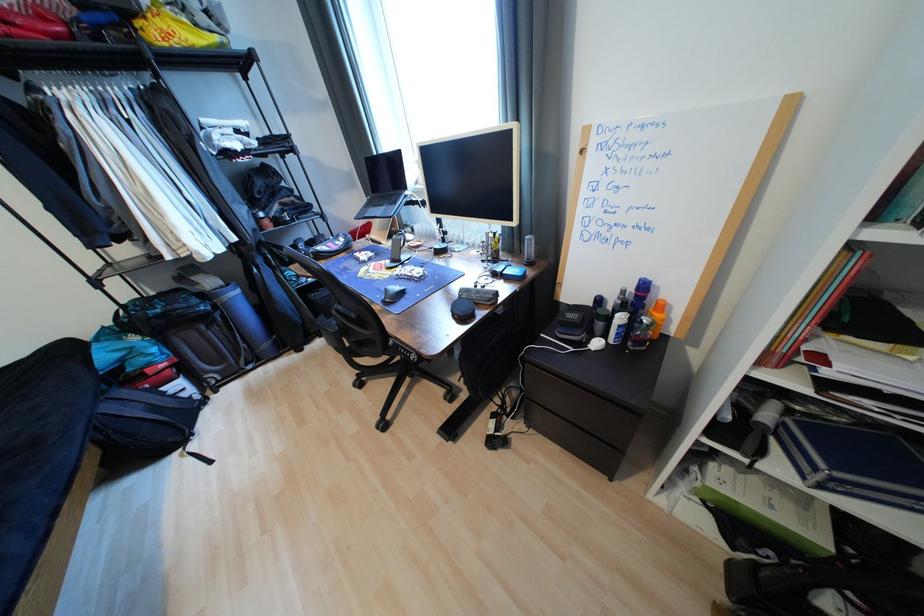
At what (x,y) coordinates should I click in order to perform the action: click on black backpack. Please return your answer as a coordinate pair (x, y). The image size is (924, 616). Looking at the image, I should click on (151, 407).